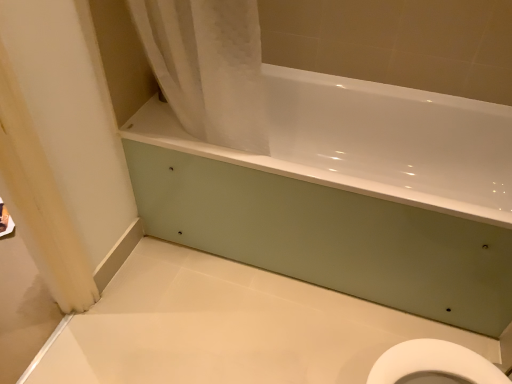
This screenshot has height=384, width=512. Find the location of `white fabric shower curtain at upper left`. white fabric shower curtain at upper left is located at coordinates (208, 67).

The width and height of the screenshot is (512, 384). Describe the element at coordinates (208, 67) in the screenshot. I see `white fabric shower curtain at upper left` at that location.

From the picture: In order to face white fabric shower curtain at upper left, should I rotate leftwards or rightwards?

It's best to rotate left around 7.310 degrees.

Describe the element at coordinates (347, 194) in the screenshot. I see `white glossy bathtub at center` at that location.

Based on the photo, measure the distance between point (234, 150) and camera.

Point (234, 150) and camera are 1.48 meters apart from each other.

Image resolution: width=512 pixels, height=384 pixels. Find the location of `white glossy bathtub at center`. white glossy bathtub at center is located at coordinates (347, 194).

I want to click on white fabric shower curtain at upper left, so click(208, 67).

Is white fabric shower curtain at upper left at the left side of white glossy bathtub at center?

Yes, white fabric shower curtain at upper left is to the left of white glossy bathtub at center.

Which is behind, white fabric shower curtain at upper left or white glossy bathtub at center?

white glossy bathtub at center is further away from the camera.

Is point (169, 78) farther from viewer compared to point (305, 81)?

No, (169, 78) is closer to viewer.

From the image's perspective, who appears lower, white fabric shower curtain at upper left or white glossy bathtub at center?

white glossy bathtub at center appears lower in the image.

From a real-world perspective, does white fabric shower curtain at upper left sit lower than white glossy bathtub at center?

Incorrect, from a real-world perspective, white fabric shower curtain at upper left is higher than white glossy bathtub at center.

Between white fabric shower curtain at upper left and white glossy bathtub at center, which one has larger width?

white glossy bathtub at center is wider.

Between white fabric shower curtain at upper left and white glossy bathtub at center, which one has more height?

white fabric shower curtain at upper left.

Is white fabric shower curtain at upper left bigger than white glossy bathtub at center?

No.

Does white fabric shower curtain at upper left contain white glossy bathtub at center?

No, white glossy bathtub at center is not surrounded by white fabric shower curtain at upper left.

Is white fabric shower curtain at upper left with white glossy bathtub at center?

They are not placed beside each other.

Is white fabric shower curtain at upper left positioned with its back to white glossy bathtub at center?

No.

How many degrees apart are the facing directions of white fabric shower curtain at upper left and white glossy bathtub at center?

They differ by 0.00107 degrees in their facing directions.

Identify the location of shower curtain on the left of white glossy bathtub at center. The height and width of the screenshot is (384, 512). (208, 67).

Considering the relative positions of white glossy bathtub at center and white fabric shower curtain at upper left in the image provided, is white glossy bathtub at center to the left or to the right of white fabric shower curtain at upper left?

From the image, it's evident that white glossy bathtub at center is to the right of white fabric shower curtain at upper left.

Considering the relative positions of white glossy bathtub at center and white fabric shower curtain at upper left in the image provided, is white glossy bathtub at center behind white fabric shower curtain at upper left?

Yes, white glossy bathtub at center is further from the viewer.

Which is behind, point (177, 182) or point (258, 22)?

Positioned behind is point (177, 182).

From the image's perspective, which is below, white glossy bathtub at center or white fabric shower curtain at upper left?

white glossy bathtub at center, from the image's perspective.

From a real-world perspective, is white glossy bathtub at center above or below white fabric shower curtain at upper left?

white glossy bathtub at center is below white fabric shower curtain at upper left.

Does white glossy bathtub at center have a lesser width compared to white fabric shower curtain at upper left?

No, white glossy bathtub at center is not thinner than white fabric shower curtain at upper left.

Considering the relative sizes of white glossy bathtub at center and white fabric shower curtain at upper left in the image provided, is white glossy bathtub at center shorter than white fabric shower curtain at upper left?

Yes, white glossy bathtub at center is shorter than white fabric shower curtain at upper left.

Considering the sizes of white glossy bathtub at center and white fabric shower curtain at upper left in the image, is white glossy bathtub at center bigger or smaller than white fabric shower curtain at upper left?

Considering their sizes, white glossy bathtub at center takes up more space than white fabric shower curtain at upper left.

Is white fabric shower curtain at upper left surrounded by white glossy bathtub at center?

No.

Is white glossy bathtub at center next to white fabric shower curtain at upper left?

No.

Does white glossy bathtub at center turn towards white fabric shower curtain at upper left?

No, white glossy bathtub at center does not turn towards white fabric shower curtain at upper left.

How many degrees apart are the facing directions of white glossy bathtub at center and white fabric shower curtain at upper left?

0.00107 degrees.

Where is `shower curtain in front of the white glossy bathtub at center`? The image size is (512, 384). shower curtain in front of the white glossy bathtub at center is located at coordinates (208, 67).

You are a GUI agent. You are given a task and a screenshot of the screen. Output one action in this format:
    pyautogui.click(x=<x>, y=<y>)
    Task: Click on the bathtub below the white fabric shower curtain at upper left (from a real-world perspective)
    The height and width of the screenshot is (384, 512).
    Given the screenshot: What is the action you would take?
    pyautogui.click(x=347, y=194)

Locate an element on the screen. bathtub below the white fabric shower curtain at upper left (from the image's perspective) is located at coordinates (347, 194).